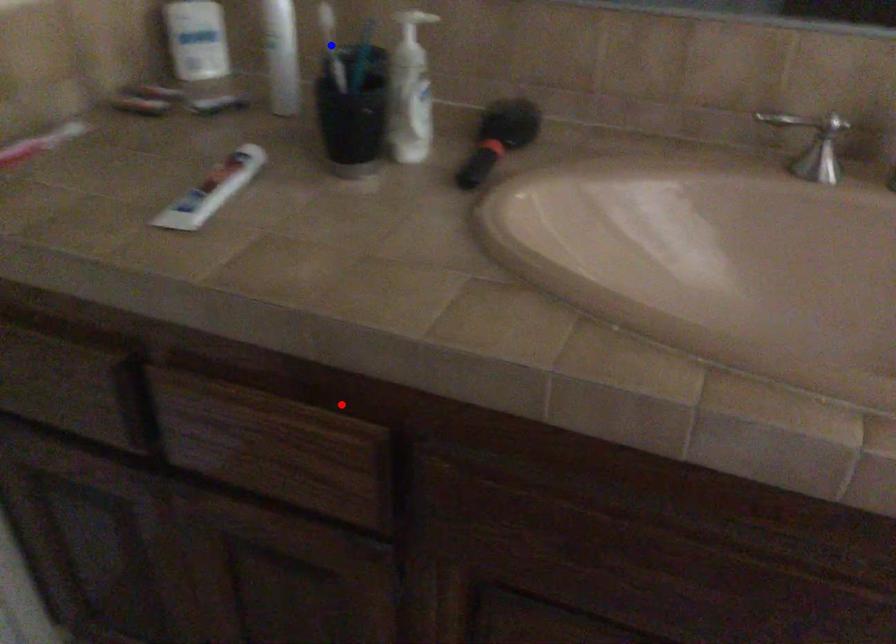
Question: Two points are marked on the image. Which point is closer to the camera?

Choices:
 (A) Blue point is closer.
 (B) Red point is closer.

Answer: (B)